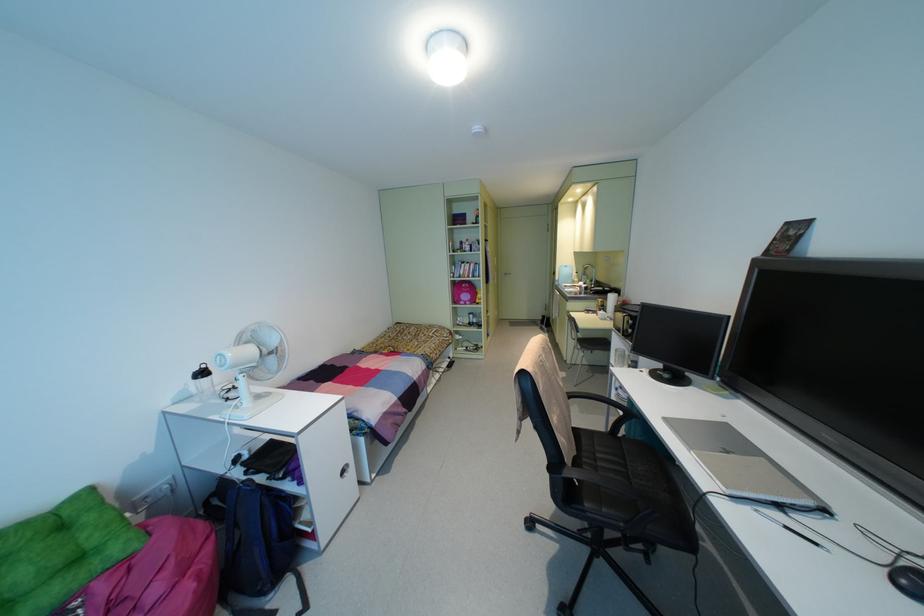
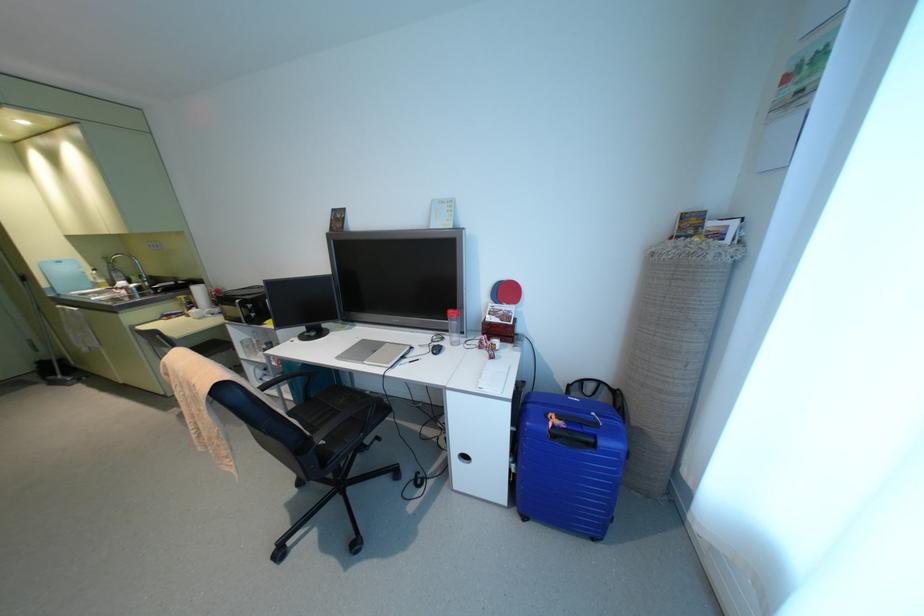
Find the pixel in the second image that matches point 611,296 in the first image.

(196, 289)